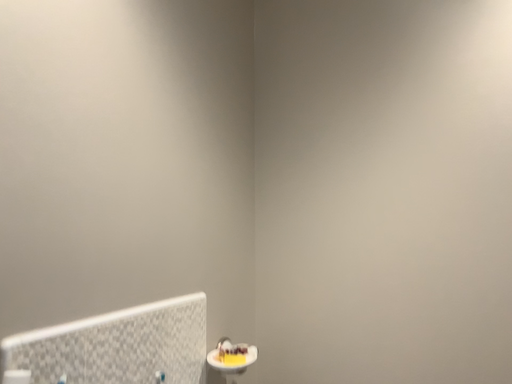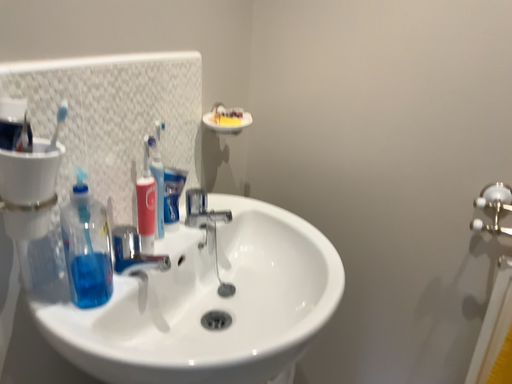
Question: How did the camera likely rotate when shooting the video?

Choices:
 (A) rotated downward
 (B) rotated upward

Answer: (A)